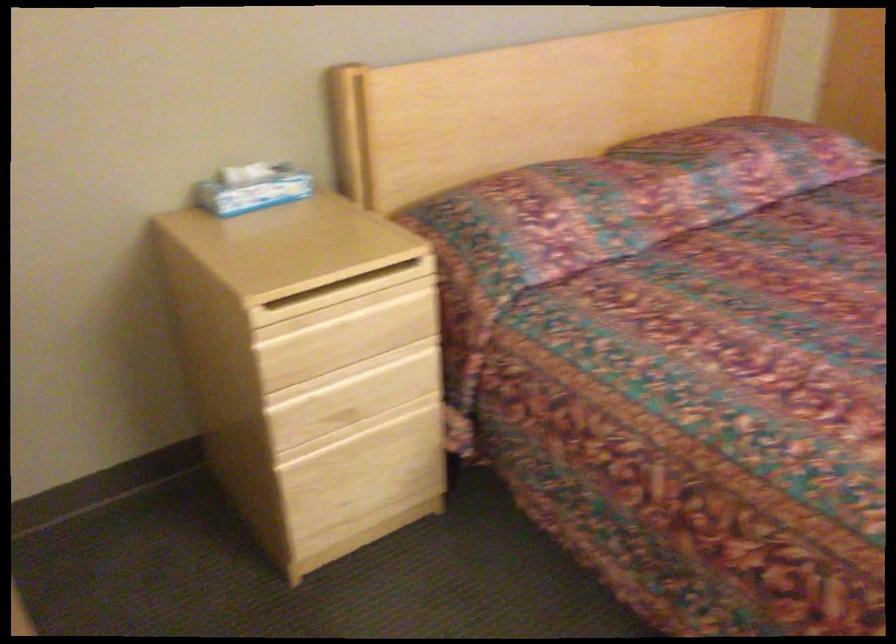
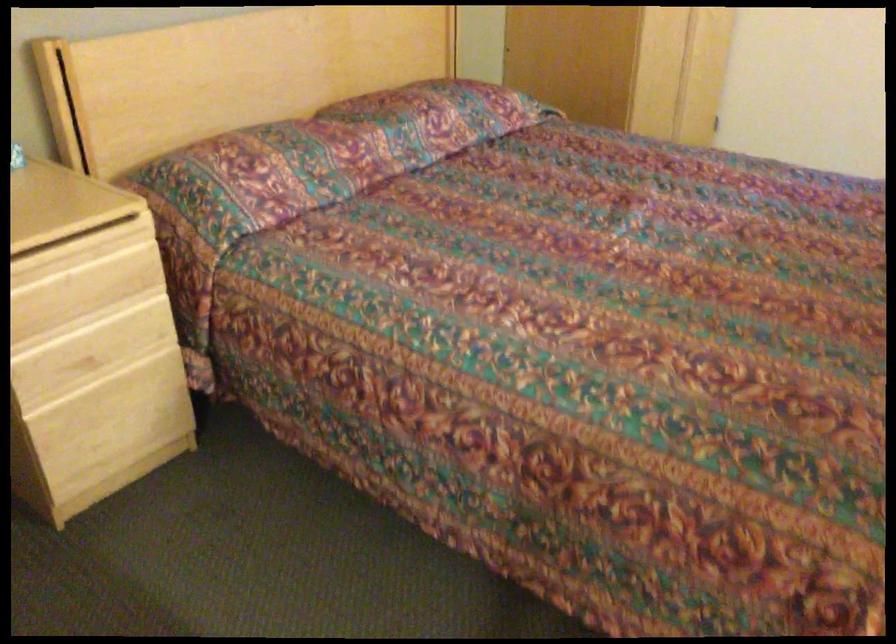
Question: The first image is from the beginning of the video and the second image is from the end. How did the camera likely rotate when shooting the video?

Choices:
 (A) Left
 (B) Right
 (C) Up
 (D) Down

Answer: (B)